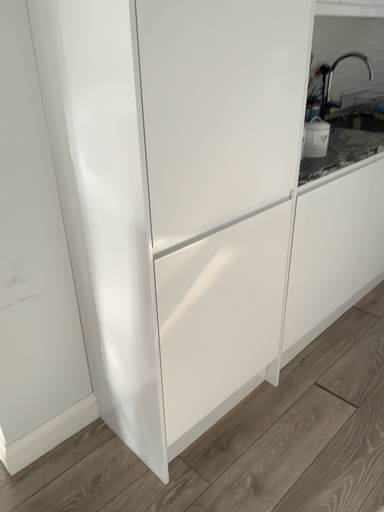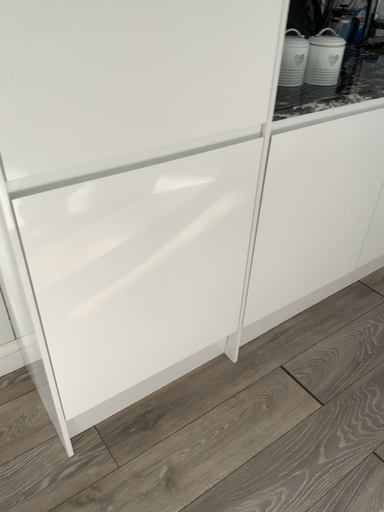
Question: Which way did the camera rotate in the video?

Choices:
 (A) rotated left
 (B) rotated right

Answer: (A)